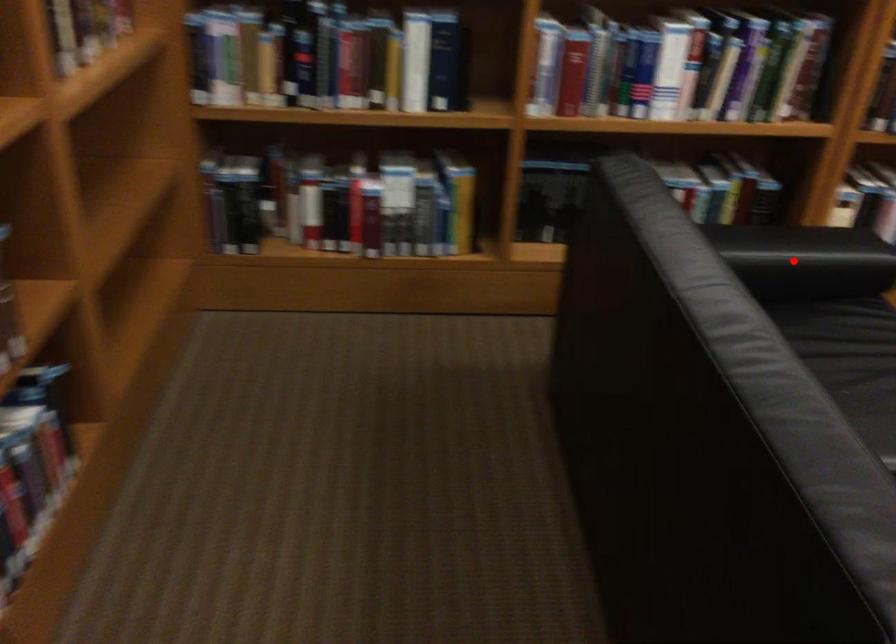
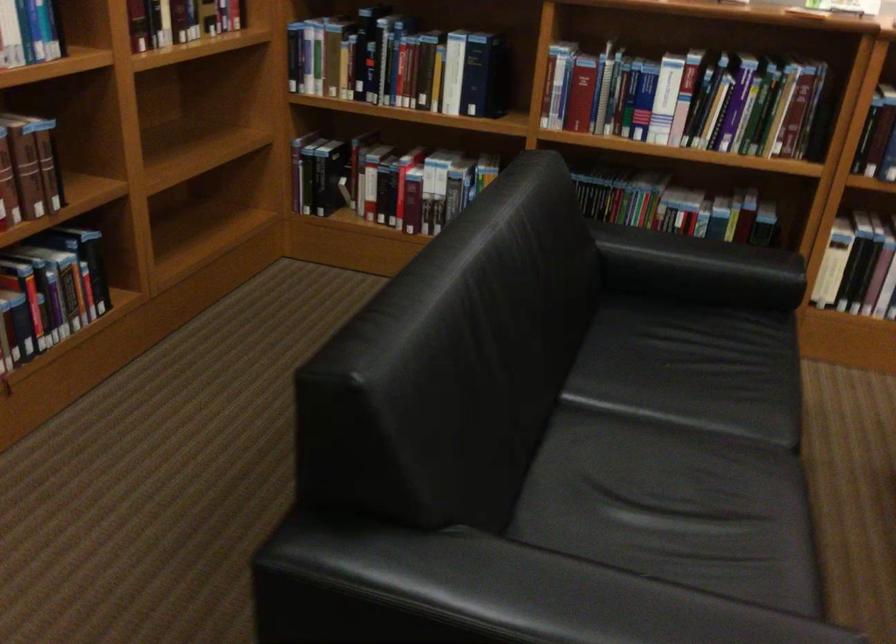
The point at the highlighted location is marked in the first image. Where is the corresponding point in the second image?

(698, 269)